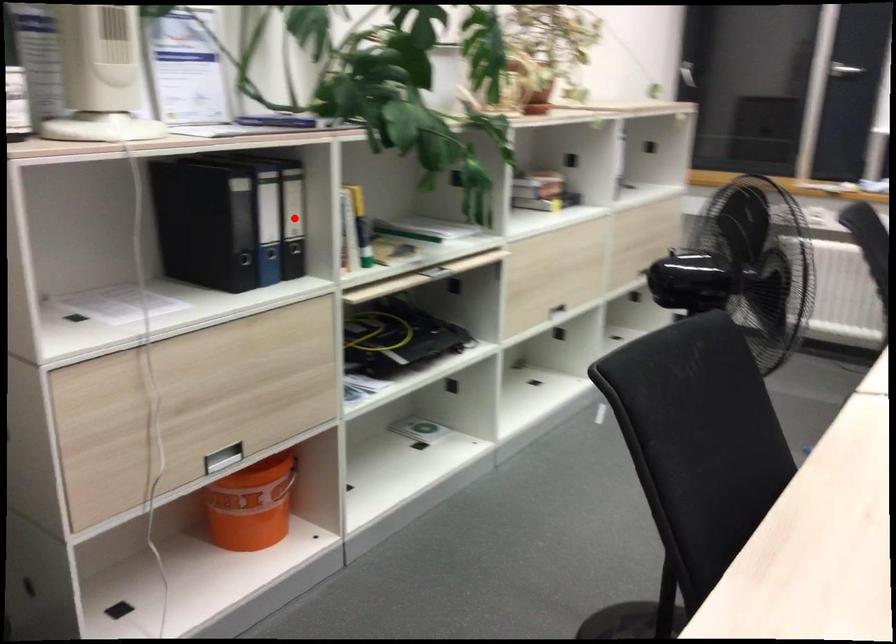
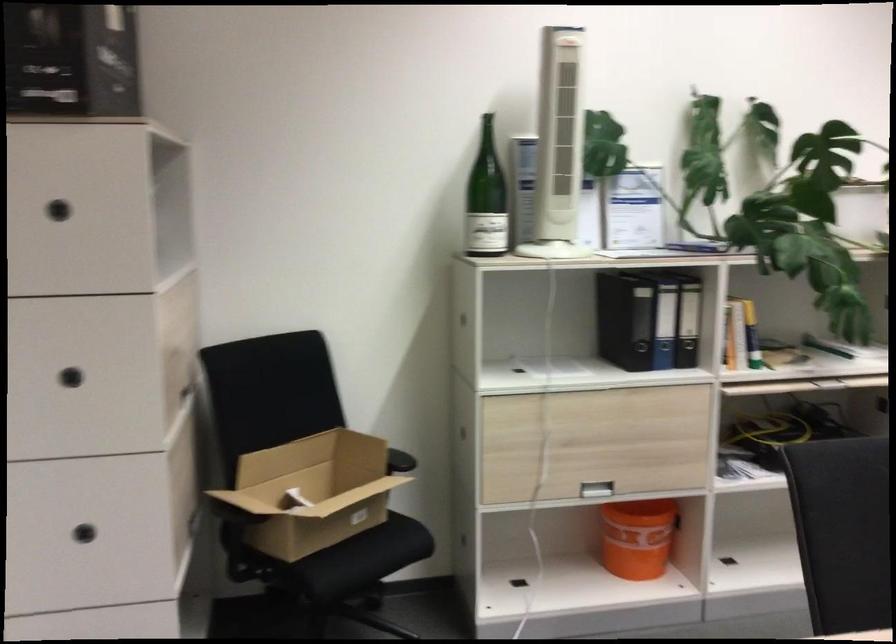
Find the pixel in the second image that matches the highlighted location in the first image.

(688, 321)